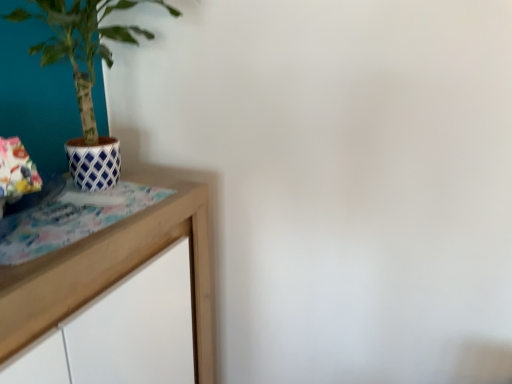
Question: Is wooden table at left wider than blue and white lattice pot at left?

Choices:
 (A) no
 (B) yes

Answer: (B)

Question: Can you confirm if wooden table at left is shorter than blue and white lattice pot at left?

Choices:
 (A) no
 (B) yes

Answer: (A)

Question: Can you confirm if wooden table at left is bigger than blue and white lattice pot at left?

Choices:
 (A) yes
 (B) no

Answer: (A)

Question: Can we say wooden table at left lies outside blue and white lattice pot at left?

Choices:
 (A) no
 (B) yes

Answer: (B)

Question: Is wooden table at left turned away from blue and white lattice pot at left?

Choices:
 (A) no
 (B) yes

Answer: (A)

Question: Is wooden table at left taller than blue and white lattice pot at left?

Choices:
 (A) yes
 (B) no

Answer: (A)

Question: Does blue and white lattice pot at left have a smaller size compared to wooden table at left?

Choices:
 (A) yes
 (B) no

Answer: (A)

Question: Can you confirm if blue and white lattice pot at left is wider than wooden table at left?

Choices:
 (A) yes
 (B) no

Answer: (B)

Question: Does blue and white lattice pot at left have a lesser height compared to wooden table at left?

Choices:
 (A) no
 (B) yes

Answer: (B)

Question: Is blue and white lattice pot at left in front of wooden table at left?

Choices:
 (A) yes
 (B) no

Answer: (B)

Question: From a real-world perspective, is blue and white lattice pot at left located higher than wooden table at left?

Choices:
 (A) yes
 (B) no

Answer: (A)

Question: Does blue and white lattice pot at left have a greater height compared to wooden table at left?

Choices:
 (A) yes
 (B) no

Answer: (B)

Question: Is wooden table at left inside or outside of blue and white lattice pot at left?

Choices:
 (A) outside
 (B) inside

Answer: (A)